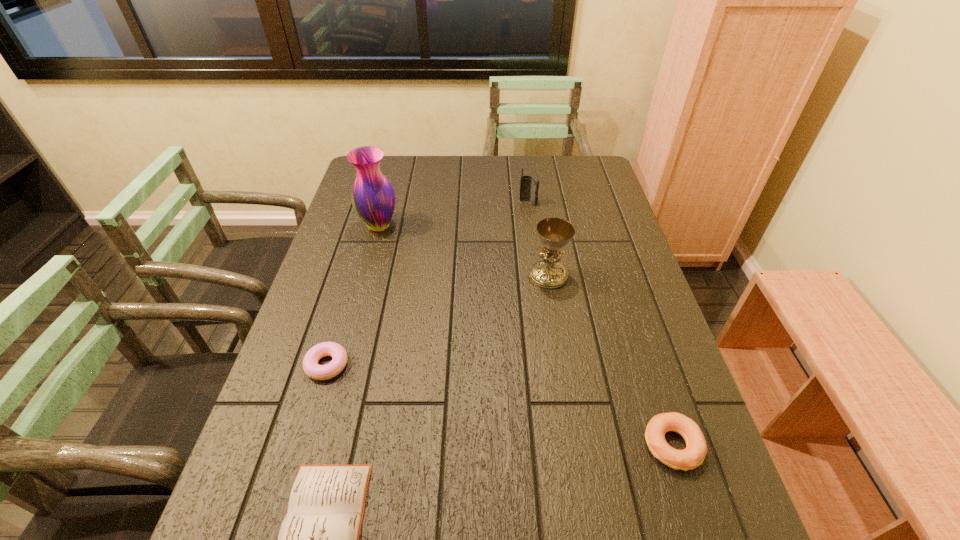
Where is `vase`? vase is located at coordinates (373, 198).

Where is `the fifth nearest object`? The height and width of the screenshot is (540, 960). the fifth nearest object is located at coordinates (373, 198).

You are a GUI agent. You are given a task and a screenshot of the screen. Output one action in this format:
    pyautogui.click(x=<x>, y=<y>)
    Task: Click on the fourth nearest object
    The height and width of the screenshot is (540, 960).
    Given the screenshot: What is the action you would take?
    pyautogui.click(x=554, y=233)

Where is `chalice`? chalice is located at coordinates (554, 233).

You are a GUI agent. You are given a task and a screenshot of the screen. Output one action in this format:
    pyautogui.click(x=<x>, y=<y>)
    Task: Click on the farthest object
    This screenshot has width=960, height=540.
    Given the screenshot: What is the action you would take?
    pyautogui.click(x=529, y=185)

I want to click on cellular telephone, so click(x=529, y=185).

You are a GUI agent. You are given a task and a screenshot of the screen. Output one action in this format:
    pyautogui.click(x=<x>, y=<y>)
    Task: Click on the rightmost object
    
    Given the screenshot: What is the action you would take?
    pyautogui.click(x=693, y=455)

Where is `the third shortest object`? The width and height of the screenshot is (960, 540). the third shortest object is located at coordinates (693, 455).

Find the location of a particular element. The image size is (960, 540). the third nearest object is located at coordinates [x=311, y=367].

Locate an element on the screen. the second shortest object is located at coordinates (311, 367).